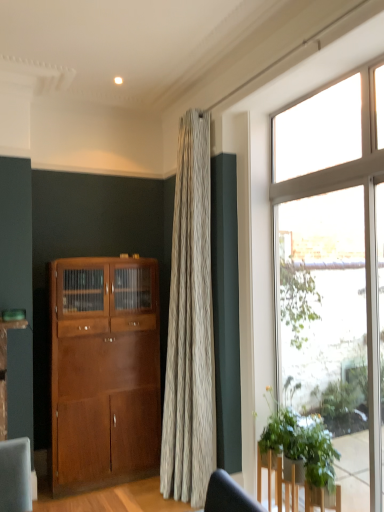
Question: Is clear glass window at right to the left or to the right of shiny brown cabinet at left in the image?

Choices:
 (A) right
 (B) left

Answer: (A)

Question: Does point (364, 458) appear closer or farther from the camera than point (132, 426)?

Choices:
 (A) closer
 (B) farther

Answer: (A)

Question: Estimate the real-world distances between objects in this image. Which object is farther from the shiny brown cabinet at left?

Choices:
 (A) green leafy plant at lower right
 (B) clear glass window at right

Answer: (B)

Question: Estimate the real-world distances between objects in this image. Which object is farther from the clear glass window at right?

Choices:
 (A) green leafy plant at lower right
 (B) shiny brown cabinet at left

Answer: (B)